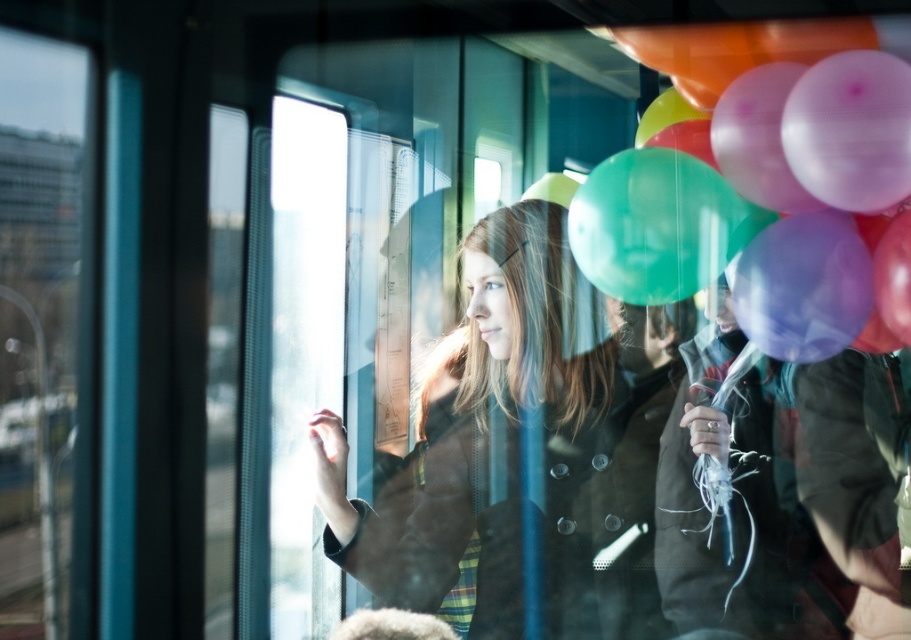
Question: In this image, where is matte brown coat at center located relative to translucent rubber balloons at upper right?

Choices:
 (A) above
 (B) below

Answer: (B)

Question: Which of the following is the farthest from the observer?

Choices:
 (A) (740, 61)
 (B) (601, 467)

Answer: (B)

Question: Can you confirm if matte brown coat at center is thinner than translucent rubber balloons at upper right?

Choices:
 (A) no
 (B) yes

Answer: (A)

Question: Is matte brown coat at center above translucent rubber balloons at upper right?

Choices:
 (A) yes
 (B) no

Answer: (B)

Question: Which object is closer to the camera taking this photo?

Choices:
 (A) translucent rubber balloons at upper right
 (B) matte brown coat at center

Answer: (A)

Question: Among these objects, which one is farthest from the camera?

Choices:
 (A) matte brown coat at center
 (B) translucent rubber balloons at upper right

Answer: (A)